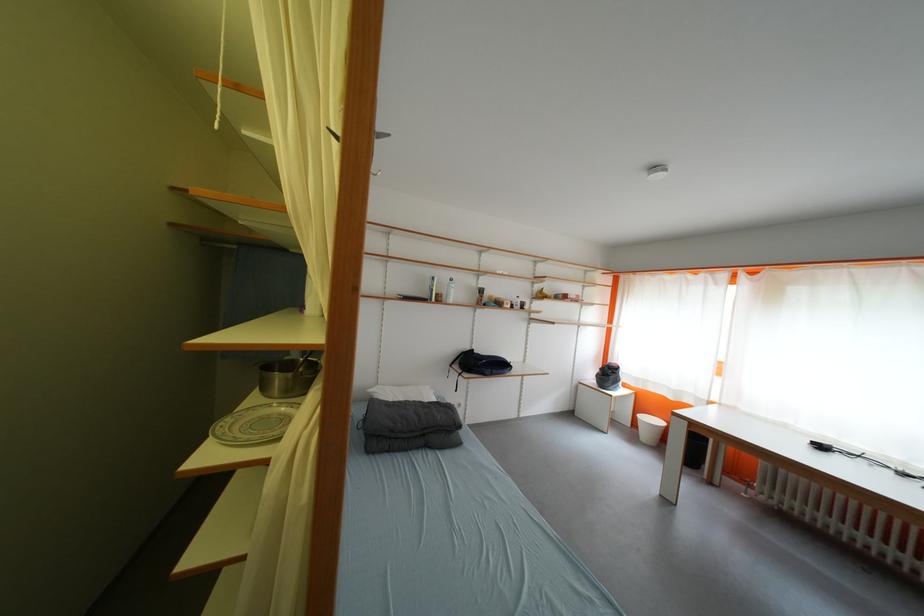
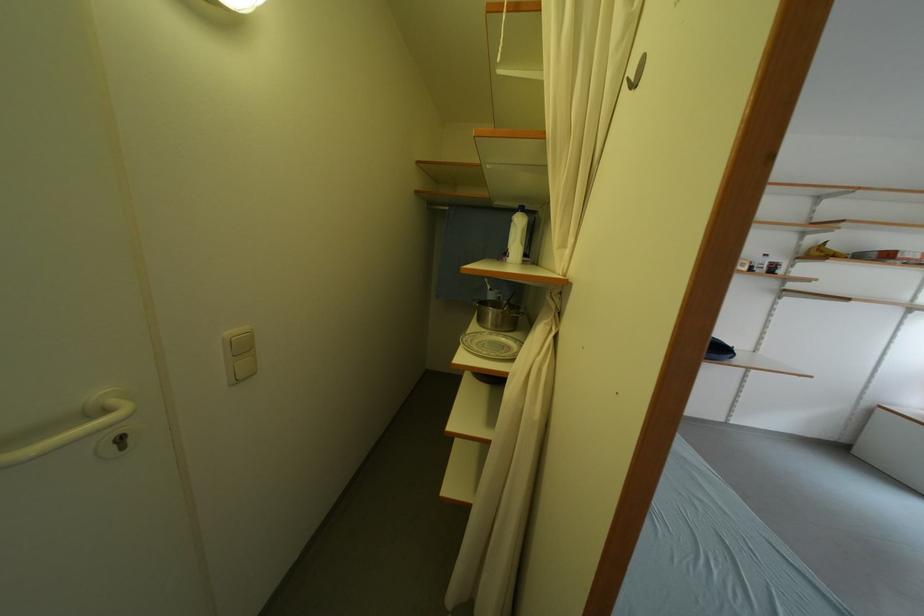
The point at (286, 382) is marked in the first image. Where is the corresponding point in the second image?

(500, 317)